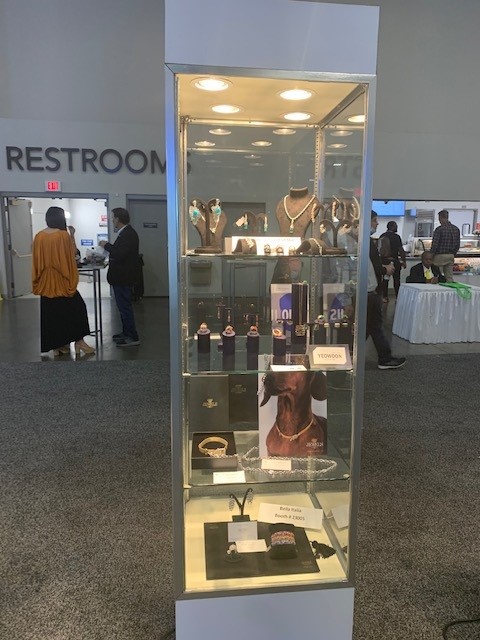
Locate an element on the screen. This screenshot has width=480, height=640. fancy table cover is located at coordinates (429, 314).